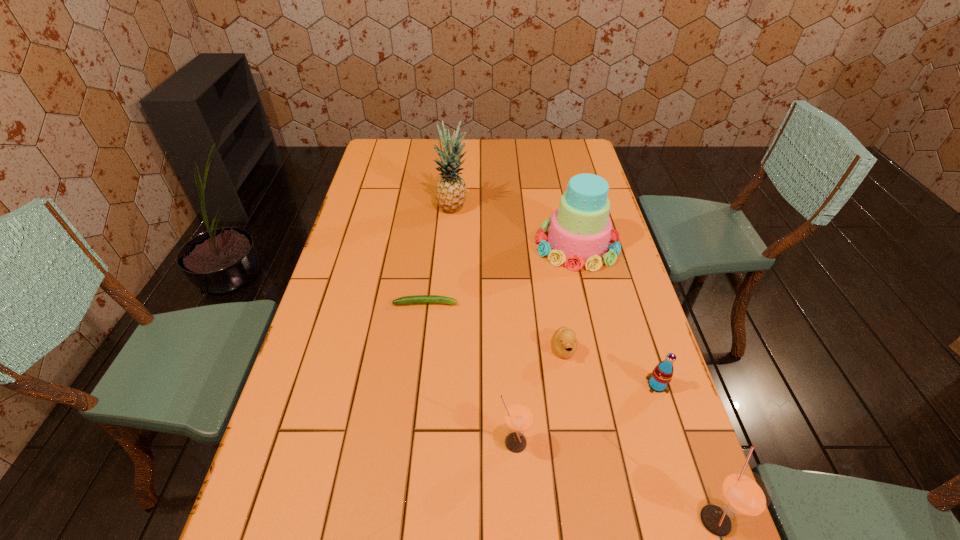
Find the location of `free space between the third nearest object and the tallest object`. free space between the third nearest object and the tallest object is located at coordinates (555, 297).

Where is `free spot between the soda and the second shortest object`? Image resolution: width=960 pixels, height=540 pixels. free spot between the soda and the second shortest object is located at coordinates (611, 367).

Where is `the second closest object relative to the nearest object`? This screenshot has width=960, height=540. the second closest object relative to the nearest object is located at coordinates (518, 416).

Locate which object ranks in proximity to the second shortest object. Please provide its 2D coordinates. Your answer should be formatted as a tuple, i.e. [(x, y)], where the tuple contains the x and y coordinates of a point satisfying the conditions above.

[(658, 381)]

I want to click on vacant space that satisfies the following two spatial constraints: 1. on the front-facing side of the shortest object; 2. on the left side of the fourth tallest object, so click(x=409, y=442).

Where is `vacant region that satisfies the following two spatial constraints: 1. on the front side of the second nearest object; 2. on the left side of the pineapple`? The width and height of the screenshot is (960, 540). vacant region that satisfies the following two spatial constraints: 1. on the front side of the second nearest object; 2. on the left side of the pineapple is located at coordinates [x=436, y=442].